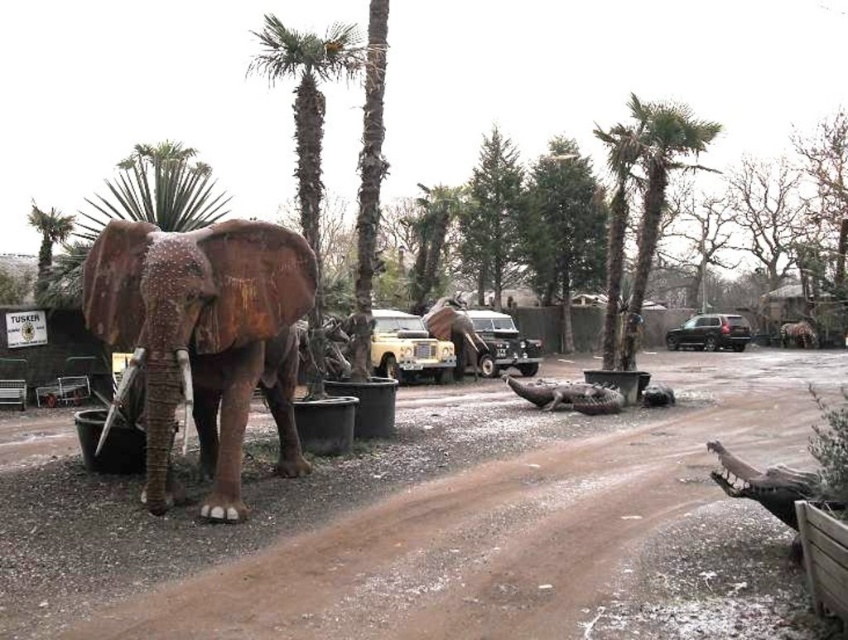
You are a visitor at the zoo and want to take a photo of the rusty brown elephant at left and the green leafy palm tree at upper left. Which object will appear larger in the photo?

The rusty brown elephant at left will appear larger in the photo because it is closer to the camera than the green leafy palm tree at upper left.

You are a visitor standing in front of the rusty brown elephant at left and want to take a photo of the green leafy palm tree at center. Which object is closer to you when you take the photo?

The rusty brown elephant at left is closer to the viewer than the green leafy palm tree at center, so when taking the photo, the rusty brown elephant at left will appear closer in the frame.

You are a zookeeper who needs to place a 2.5 meter long fence panel between the rusty brown elephant at left and the green leafy palm tree at center. Can you fit the fence panel between them?

The distance between the rusty brown elephant at left and the green leafy palm tree at center is 2.15 meters. Since the fence panel is 2.5 meters long, it cannot fit between them as the available space is shorter than the panel.